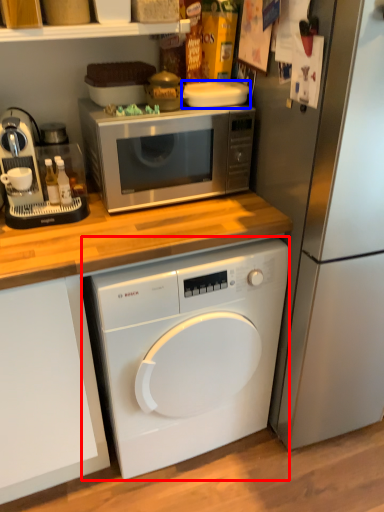
Question: Which object is closer to the camera taking this photo, washing machine (highlighted by a red box) or appliance (highlighted by a blue box)?

Choices:
 (A) washing machine
 (B) appliance

Answer: (A)